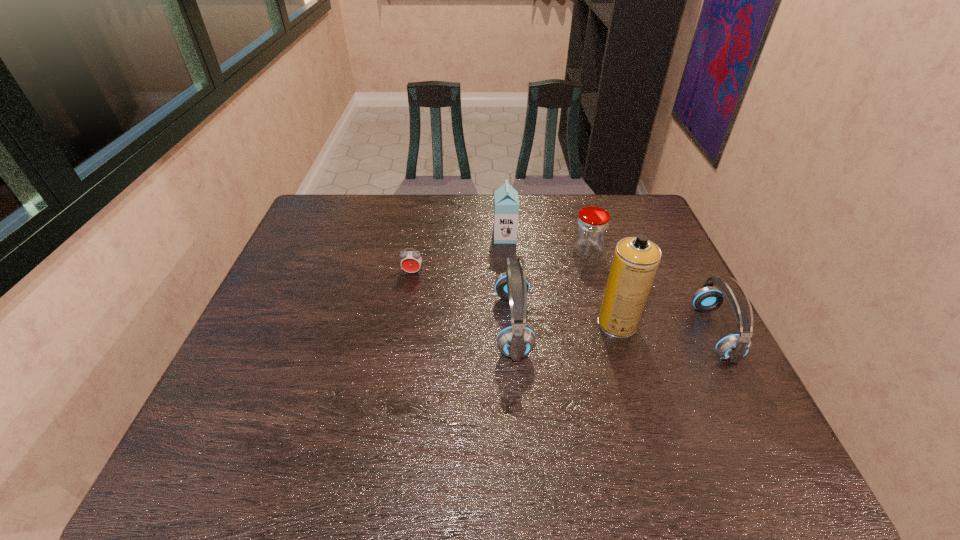
I want to click on vacant space at the far right corner of the desktop, so click(644, 198).

In order to click on free spot between the leftmost object and the milk carton in this screenshot , I will do `click(459, 254)`.

Locate an element on the screen. This screenshot has width=960, height=540. vacant point located between the right headset and the jar is located at coordinates (651, 292).

I want to click on empty space between the jar and the fourth nearest object, so click(500, 262).

I want to click on free area in between the leftmost object and the left headset, so click(x=463, y=299).

Identify the location of blank region between the tallest object and the left headset. (565, 324).

You are a GUI agent. You are given a task and a screenshot of the screen. Output one action in this format:
    pyautogui.click(x=<x>, y=<y>)
    Task: Click on the free space between the shortest object and the shorter headset
    The height and width of the screenshot is (540, 960).
    Given the screenshot: What is the action you would take?
    pyautogui.click(x=564, y=302)

Locate which object is the fifth closest to the shorter headset. Please provide its 2D coordinates. Your answer should be formatted as a tuple, i.e. [(x, y)], where the tuple contains the x and y coordinates of a point satisfying the conditions above.

[(411, 261)]

Identify which object is the fifth nearest to the left headset. Please provide its 2D coordinates. Your answer should be formatted as a tuple, i.e. [(x, y)], where the tuple contains the x and y coordinates of a point satisfying the conditions above.

[(732, 347)]

Where is `vacant region that satisfies the following two spatial constraints: 1. on the front side of the milk carton; 2. on the right side of the jar`? vacant region that satisfies the following two spatial constraints: 1. on the front side of the milk carton; 2. on the right side of the jar is located at coordinates (506, 252).